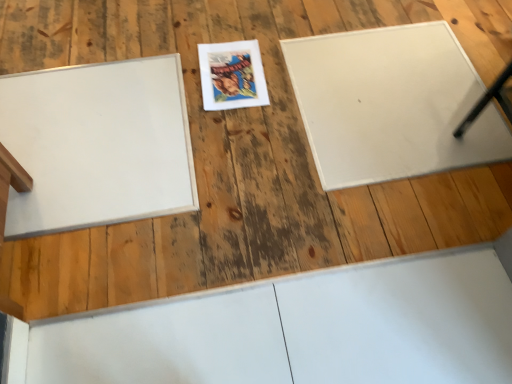
Identify the location of free space to the right of white matte board at left, which appears as the 2th bulletin board when viewed from the right. (273, 148).